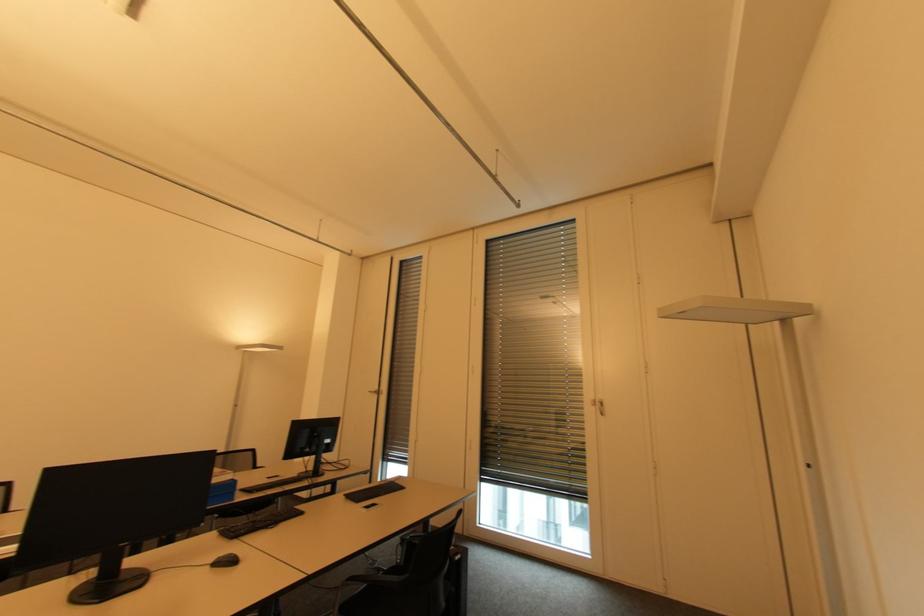
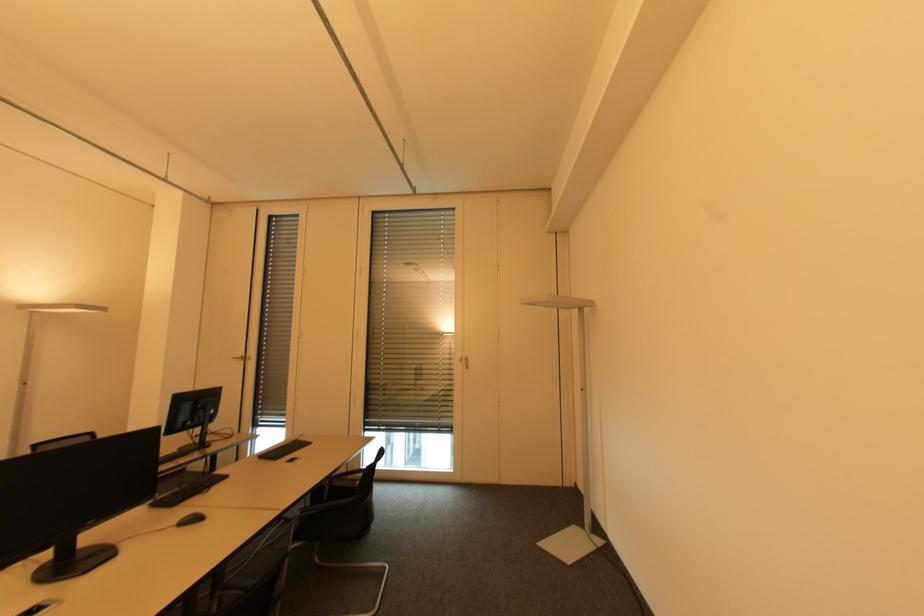
What movement of the cameraman would produce the second image?

The cameraman walked toward left, backward.